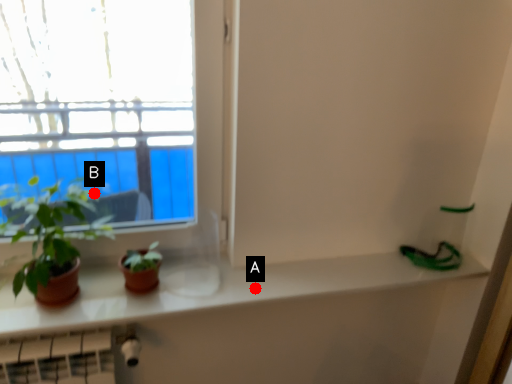
Question: Two points are circled on the image, labeled by A and B beside each circle. Which point is closer to the camera taking this photo?

Choices:
 (A) A is closer
 (B) B is closer

Answer: (A)